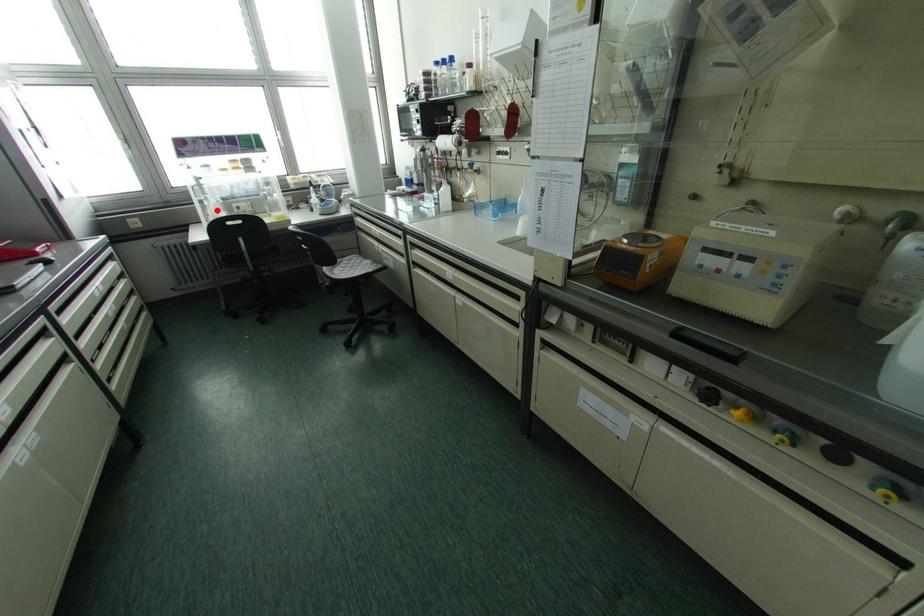
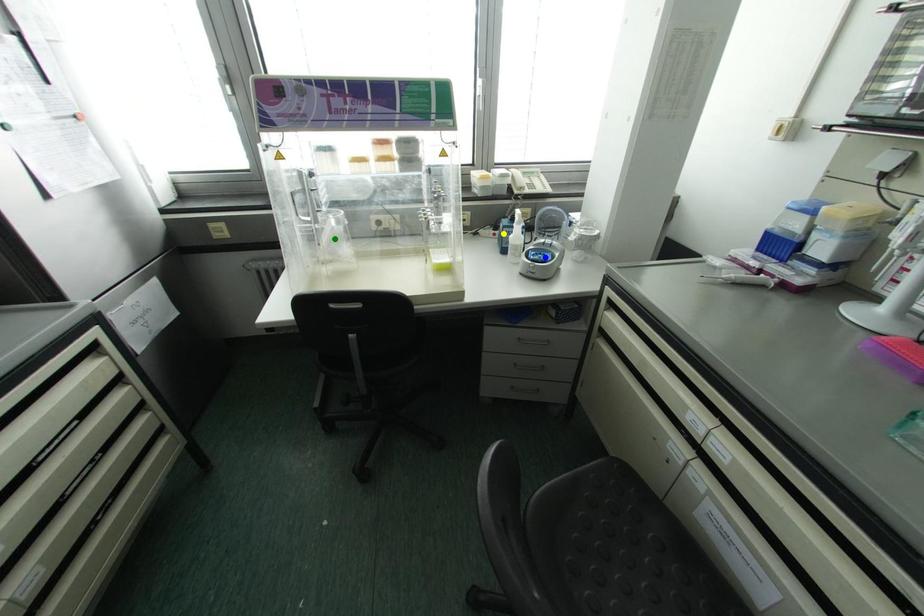
Question: I am providing you with two images of the same scene from different viewpoints. A red point is marked on the first image. You are given multiple points on the second image. In image 2, which mark is for the same physical point as the one in image 1?

Choices:
 (A) yellow point
 (B) blue point
 (C) green point

Answer: (C)